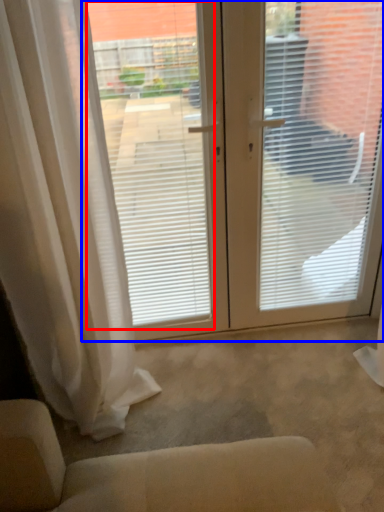
Question: Which object appears farthest to the camera in this image, window screen (highlighted by a red box) or window screen (highlighted by a blue box)?

Choices:
 (A) window screen
 (B) window screen

Answer: (B)